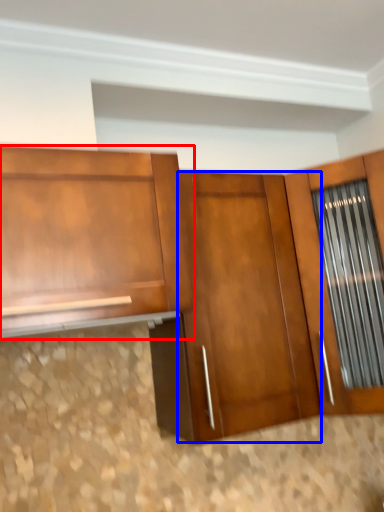
Question: Which point is further to the camera, cabinetry (highlighted by a red box) or door (highlighted by a blue box)?

Choices:
 (A) cabinetry
 (B) door

Answer: (B)